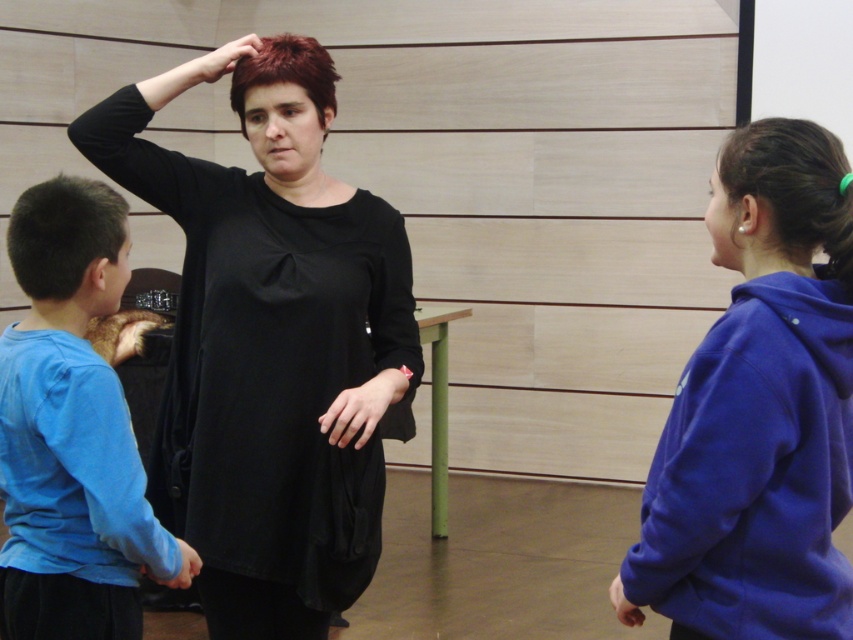
Which is more to the left, matte blue hoodie at right or matte skin hand at lower center?

From the viewer's perspective, matte skin hand at lower center appears more on the left side.

Is point (788, 493) farther from camera compared to point (621, 612)?

No, it is not.

Which is behind, point (665, 582) or point (611, 596)?

The point (611, 596) is behind.

Identify the location of matte blue hoodie at right. The width and height of the screenshot is (853, 640). (757, 417).

Between blue cotton shirt at left and shiny red hair at center, which one has more height?

Standing taller between the two is blue cotton shirt at left.

Locate an element on the screen. blue cotton shirt at left is located at coordinates (70, 429).

Is green rubber band at upper right to the right of blue fabric hand at lower left from the viewer's perspective?

Yes, green rubber band at upper right is to the right of blue fabric hand at lower left.

Which of these two, green rubber band at upper right or blue fabric hand at lower left, stands shorter?

blue fabric hand at lower left

Locate an element on the screen. The height and width of the screenshot is (640, 853). green rubber band at upper right is located at coordinates (836, 225).

I want to click on green rubber band at upper right, so click(836, 225).